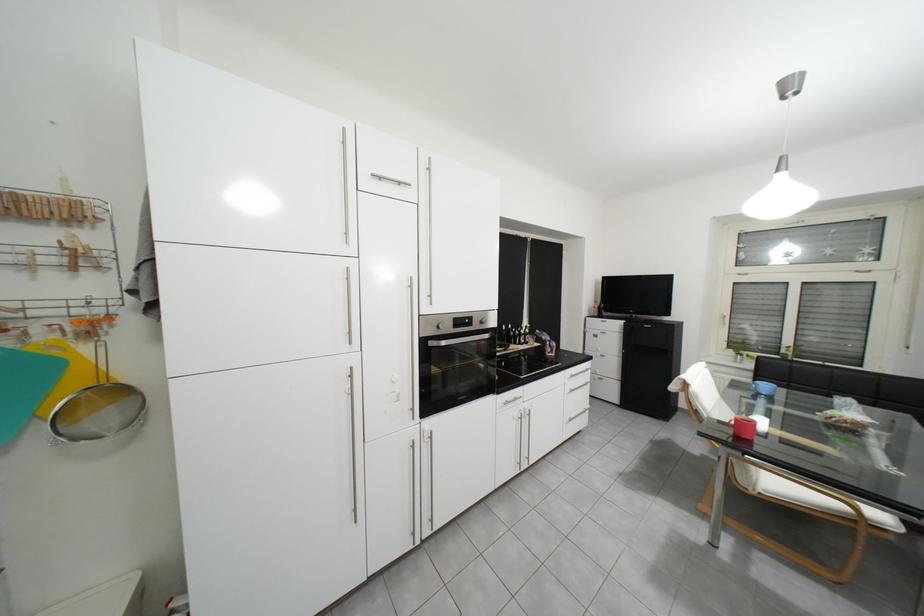
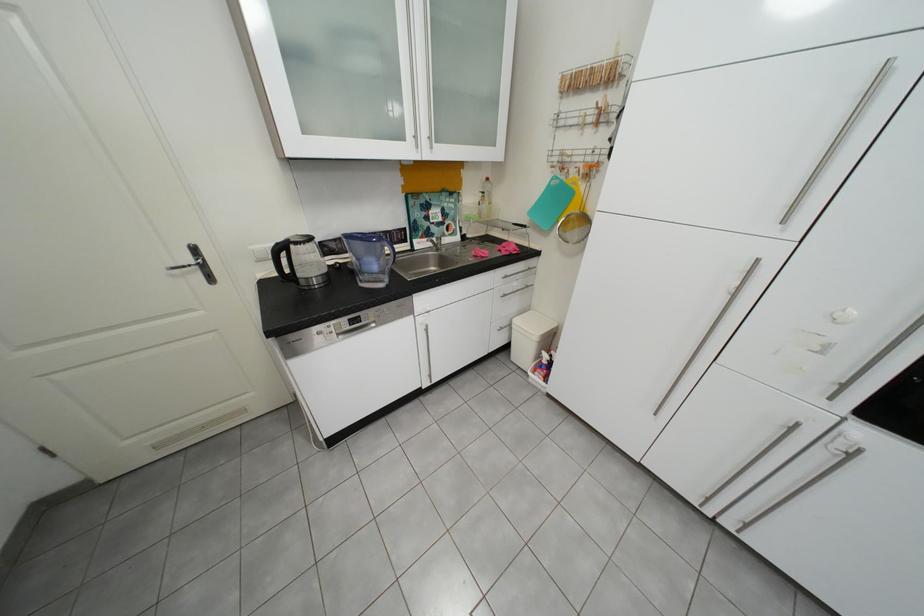
The images are taken continuously from a first-person perspective. In which direction is your viewpoint rotating?

The rotation direction of the camera is left-down.